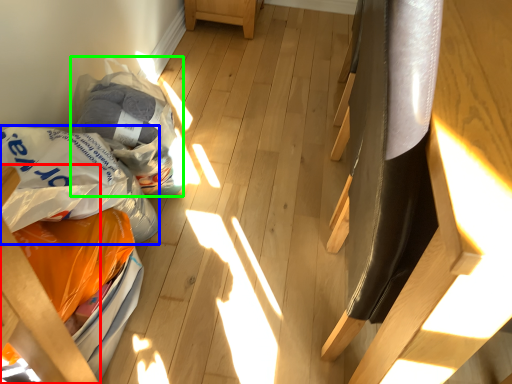
Question: Which object is positioned closest to furniture (highlighted by a red box)? Select from grocery bag (highlighted by a blue box) and grocery bag (highlighted by a green box).

Choices:
 (A) grocery bag
 (B) grocery bag

Answer: (A)